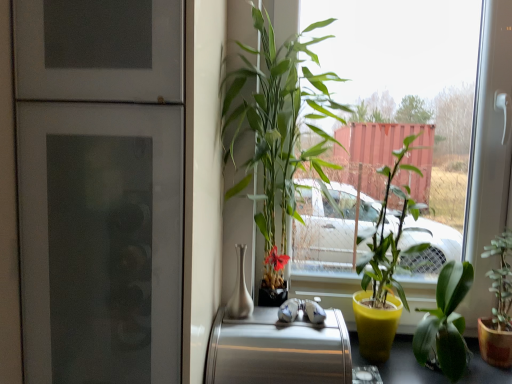
Question: Is smooth black table at lower right facing away from green glossy plant at center, positioned as the 1th houseplant in left-to-right order?

Choices:
 (A) yes
 (B) no

Answer: (B)

Question: Is smooth black table at lower right to the right of green glossy plant at center, positioned as the 1th houseplant in left-to-right order, from the viewer's perspective?

Choices:
 (A) yes
 (B) no

Answer: (A)

Question: From the image's perspective, is smooth black table at lower right above green glossy plant at center, the fourth houseplant from the right?

Choices:
 (A) yes
 (B) no

Answer: (B)

Question: Are smooth black table at lower right and green glossy plant at center, the fourth houseplant from the right, far apart?

Choices:
 (A) yes
 (B) no

Answer: (B)

Question: From the image's perspective, is smooth black table at lower right under green glossy plant at center, positioned as the 1th houseplant in left-to-right order?

Choices:
 (A) no
 (B) yes

Answer: (B)

Question: Is green leafy plant at center wider or thinner than green matte plant at lower right, acting as the fourth houseplant starting from the left?

Choices:
 (A) wide
 (B) thin

Answer: (A)

Question: From their relative heights in the image, would you say green leafy plant at center is taller or shorter than green matte plant at lower right, which is the first houseplant in right-to-left order?

Choices:
 (A) tall
 (B) short

Answer: (A)

Question: From a real-world perspective, relative to green matte plant at lower right, which is the first houseplant in right-to-left order, is green leafy plant at center vertically above or below?

Choices:
 (A) below
 (B) above

Answer: (B)

Question: From the image's perspective, is green leafy plant at center positioned above or below green matte plant at lower right, acting as the fourth houseplant starting from the left?

Choices:
 (A) below
 (B) above

Answer: (B)

Question: In terms of size, does brushed metal toaster at center appear bigger or smaller than green leafy plant at center?

Choices:
 (A) big
 (B) small

Answer: (B)

Question: Is brushed metal toaster at center inside or outside of green leafy plant at center?

Choices:
 (A) outside
 (B) inside

Answer: (B)

Question: Considering the positions of brushed metal toaster at center and green leafy plant at center in the image, is brushed metal toaster at center taller or shorter than green leafy plant at center?

Choices:
 (A) tall
 (B) short

Answer: (B)

Question: Does point (218, 317) appear closer or farther from the camera than point (485, 132)?

Choices:
 (A) farther
 (B) closer

Answer: (B)

Question: From a real-world perspective, is green leafy plant at center physically located above or below brushed metal toaster at center?

Choices:
 (A) above
 (B) below

Answer: (A)

Question: Would you say green leafy plant at center is inside or outside brushed metal toaster at center?

Choices:
 (A) outside
 (B) inside

Answer: (A)